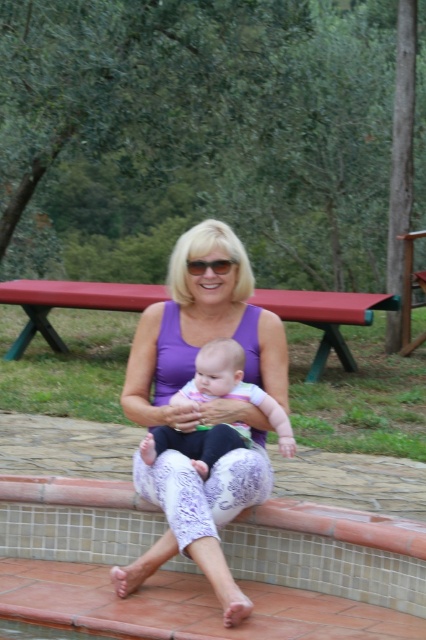
You are a photographer setting up a shot of the woman and baby. You need to ensure the purple lace pants at center and the red painted wood picnic table at center are both in focus. Which object should you adjust your camera focus on first to ensure both are sharp?

The purple lace pants at center is thinner than the red painted wood picnic table at center, so you should focus on the purple lace pants at center first since it has a smaller size and adjusting focus starting from the thinner object ensures better sharpness for both.